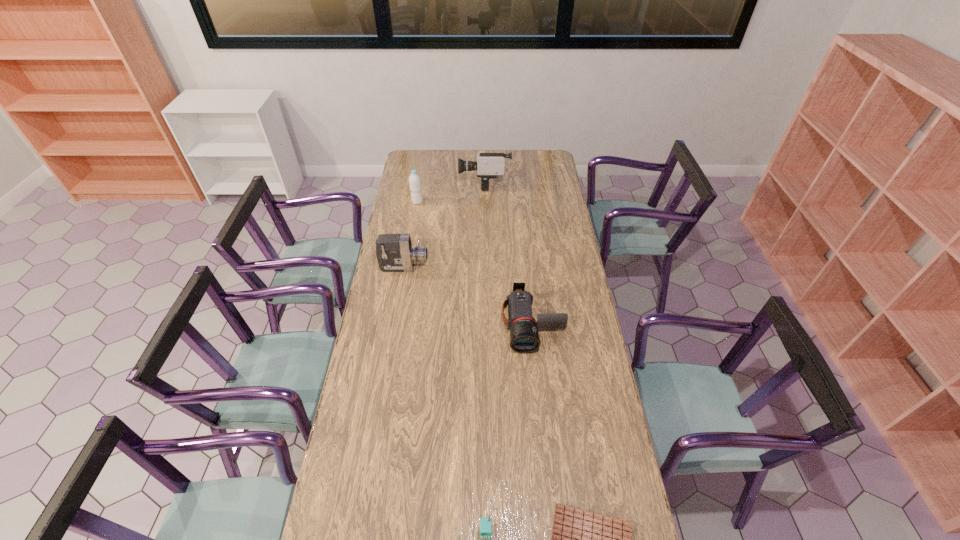
You are a GUI agent. You are given a task and a screenshot of the screen. Output one action in this format:
    pyautogui.click(x=<x>, y=<y>)
    Task: Click on the vacant space positioned on the front of the water bottle
    The height and width of the screenshot is (540, 960).
    Given the screenshot: What is the action you would take?
    pyautogui.click(x=416, y=214)

Find the location of `vacant region located at the front of the leftmost camcorder, highlighting the lens`. vacant region located at the front of the leftmost camcorder, highlighting the lens is located at coordinates (468, 267).

Find the location of `free space located 0.340m on the lens of the third nearest object`. free space located 0.340m on the lens of the third nearest object is located at coordinates (544, 438).

This screenshot has height=540, width=960. I want to click on water bottle present at the left edge, so click(x=414, y=179).

Identify the location of camcorder located at the left edge. (394, 252).

I want to click on object positioned at the right edge, so click(x=524, y=336).

Locate an element on the screen. vacant space at the far edge of the desktop is located at coordinates (475, 159).

The width and height of the screenshot is (960, 540). I want to click on free spot at the left edge of the desktop, so click(395, 220).

Find the location of a particular element. vacant space at the right edge of the desktop is located at coordinates (573, 276).

The image size is (960, 540). Identify the location of vacant space at the far left corner of the desktop. pyautogui.click(x=425, y=170).